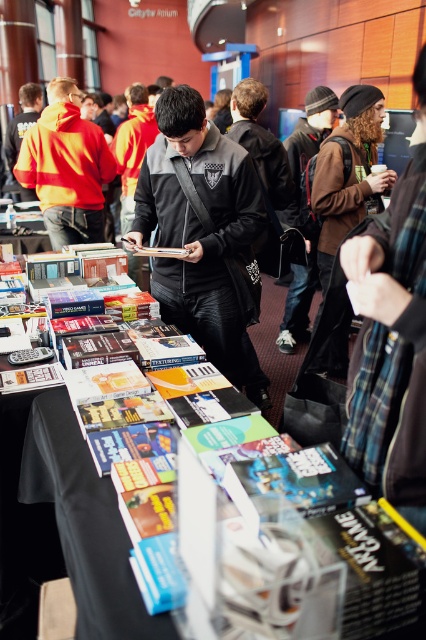
You are standing in front of the book booth and need to locate the black matte jacket at center. According to the coordinates provided, where exactly is it positioned?

The black matte jacket at center is located at point coordinates 0.367 in the x axis and 0.479 in the y axis.

From the picture: You are standing in front of the book tables and notice two jackets displayed at the center. Which jacket is closer to you, the black matte jacket at center or the brown leather jacket at center?

The black matte jacket at center is closer to you because it is in front of the brown leather jacket at center.